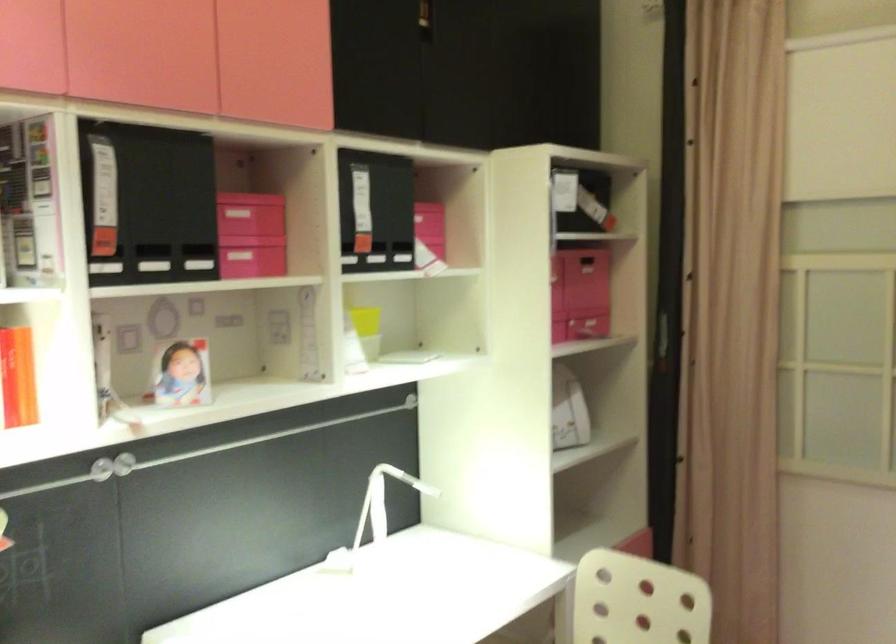
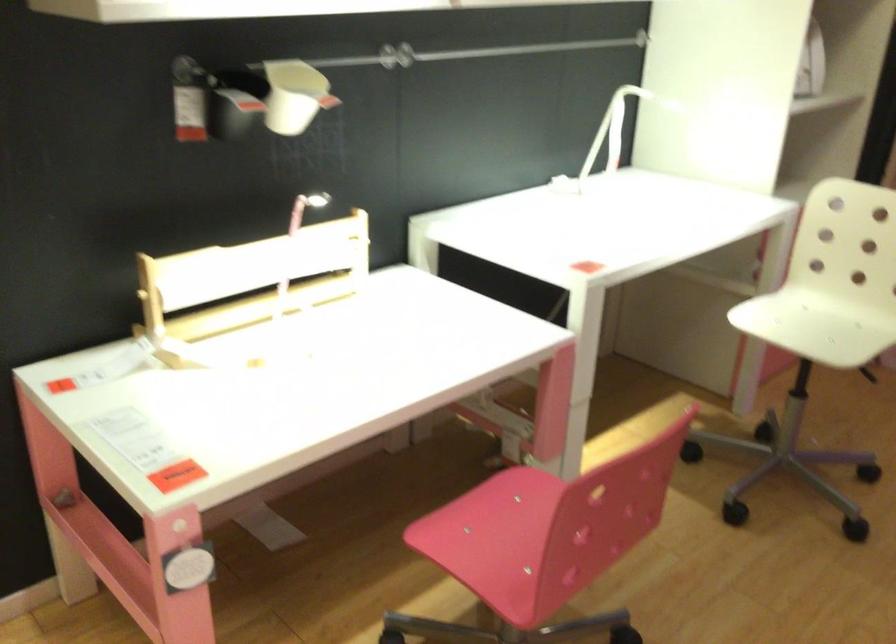
Where in the second image is the point corresponding to the point at 388,502 from the first image?

(618, 126)